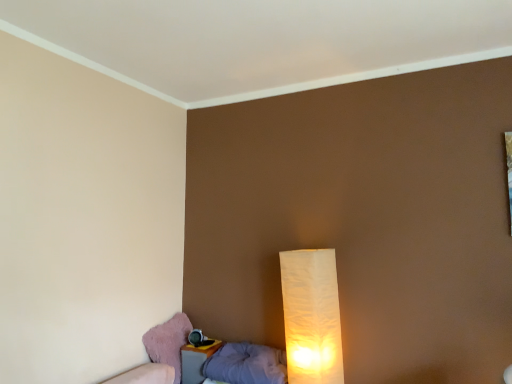
Question: Is pink fabric swivel chair at lower left wider than white paper lamp at lower right?

Choices:
 (A) no
 (B) yes

Answer: (B)

Question: Considering the relative positions of pink fabric swivel chair at lower left and white paper lamp at lower right in the image provided, is pink fabric swivel chair at lower left to the right of white paper lamp at lower right from the viewer's perspective?

Choices:
 (A) yes
 (B) no

Answer: (B)

Question: From a real-world perspective, is pink fabric swivel chair at lower left physically above white paper lamp at lower right?

Choices:
 (A) yes
 (B) no

Answer: (B)

Question: Does pink fabric swivel chair at lower left lie in front of white paper lamp at lower right?

Choices:
 (A) no
 (B) yes

Answer: (A)

Question: Is white paper lamp at lower right at the back of pink fabric swivel chair at lower left?

Choices:
 (A) no
 (B) yes

Answer: (A)

Question: Is point (314, 273) closer or farther from the camera than point (217, 344)?

Choices:
 (A) closer
 (B) farther

Answer: (A)

Question: Is white paper lamp at lower right to the left or to the right of matte plastic nightstand at lower left in the image?

Choices:
 (A) left
 (B) right

Answer: (B)

Question: Is white paper lamp at lower right spatially inside matte plastic nightstand at lower left, or outside of it?

Choices:
 (A) outside
 (B) inside

Answer: (A)

Question: Is white paper lamp at lower right taller or shorter than matte plastic nightstand at lower left?

Choices:
 (A) tall
 (B) short

Answer: (A)

Question: Considering the positions of point (200, 352) and point (325, 251), is point (200, 352) closer or farther from the camera than point (325, 251)?

Choices:
 (A) farther
 (B) closer

Answer: (A)

Question: Based on their sizes in the image, would you say matte plastic nightstand at lower left is bigger or smaller than white paper lamp at lower right?

Choices:
 (A) small
 (B) big

Answer: (A)

Question: From a real-world perspective, is matte plastic nightstand at lower left above or below white paper lamp at lower right?

Choices:
 (A) below
 (B) above

Answer: (A)

Question: From the image's perspective, relative to white paper lamp at lower right, is matte plastic nightstand at lower left above or below?

Choices:
 (A) below
 (B) above

Answer: (A)

Question: In the image, is pink fabric swivel chair at lower left on the left side or the right side of matte plastic nightstand at lower left?

Choices:
 (A) right
 (B) left

Answer: (B)

Question: From a real-world perspective, is pink fabric swivel chair at lower left above or below matte plastic nightstand at lower left?

Choices:
 (A) above
 (B) below

Answer: (A)